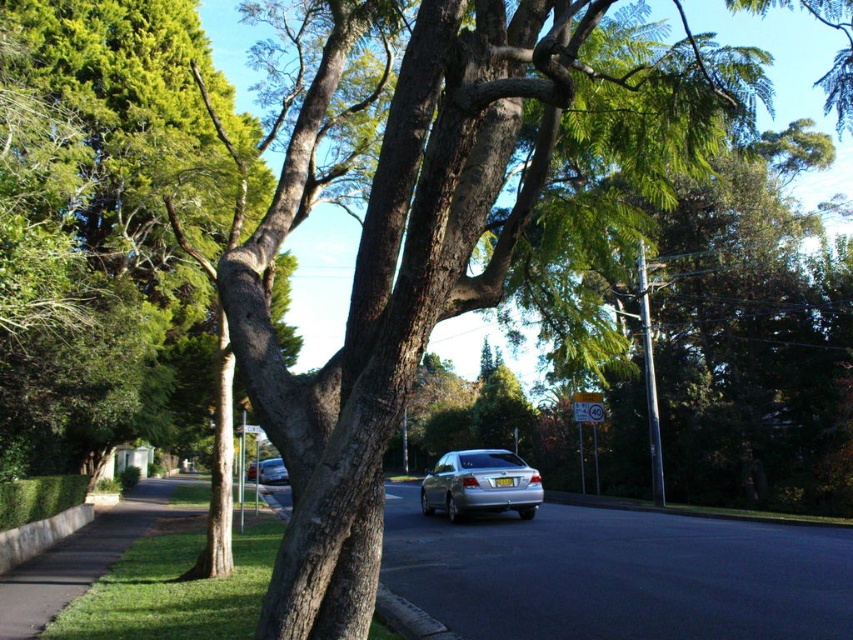
Question: Can you confirm if gray concrete curb at lower center is thinner than satin silver sedan at center?

Choices:
 (A) no
 (B) yes

Answer: (B)

Question: Which object appears farthest from the camera in this image?

Choices:
 (A) metallic reflective sign at center
 (B) silver metallic sedan at center
 (C) satin silver sedan at center
 (D) gray asphalt road at center

Answer: (C)

Question: Which point is farther from the camera taking this photo?

Choices:
 (A) (434, 484)
 (B) (264, 461)

Answer: (B)

Question: Which object is the farthest from the gray asphalt road at center?

Choices:
 (A) satin silver sedan at center
 (B) gray concrete curb at lower center
 (C) silver metallic sedan at center

Answer: (A)

Question: Does gray asphalt road at center come in front of satin silver sedan at center?

Choices:
 (A) no
 (B) yes

Answer: (B)

Question: Can you confirm if silver metallic sedan at center is thinner than gray concrete curb at lower center?

Choices:
 (A) yes
 (B) no

Answer: (B)